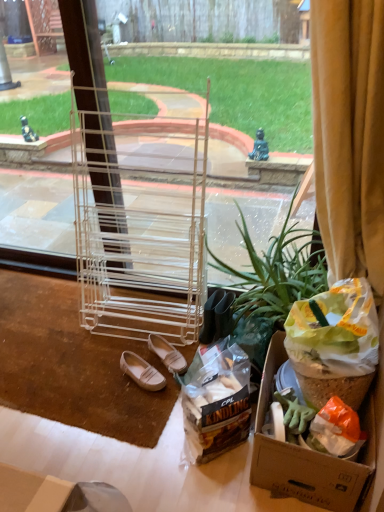
Question: In the image, is clear plastic rack at center positioned in front of or behind translucent plastic bag of kindling at lower center?

Choices:
 (A) behind
 (B) front

Answer: (B)

Question: From the image's perspective, is clear plastic rack at center positioned above or below translucent plastic bag of kindling at lower center?

Choices:
 (A) above
 (B) below

Answer: (A)

Question: Which is nearer to the translucent plastic bag of kindling at lower center?

Choices:
 (A) clear plastic rack at center
 (B) leather at center, the 2th footwear when ordered from left to right
 (C) white leather shoes at lower center, which is counted as the 2th footwear, starting from the right
 (D) green leafy plant at center
 (E) yellow velvet curtain at right

Answer: (B)

Question: Which object is the closest to the leather at center, the 2th footwear when ordered from left to right?

Choices:
 (A) translucent plastic bag of kindling at lower center
 (B) green leafy plant at center
 (C) clear plastic rack at center
 (D) yellow velvet curtain at right
 (E) white leather shoes at lower center, which is the 1th footwear from left to right

Answer: (E)